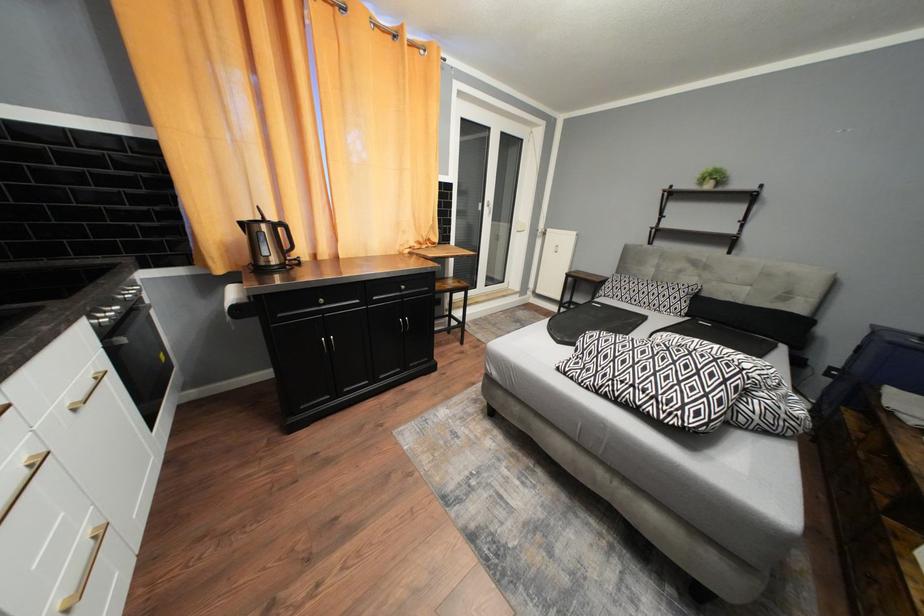
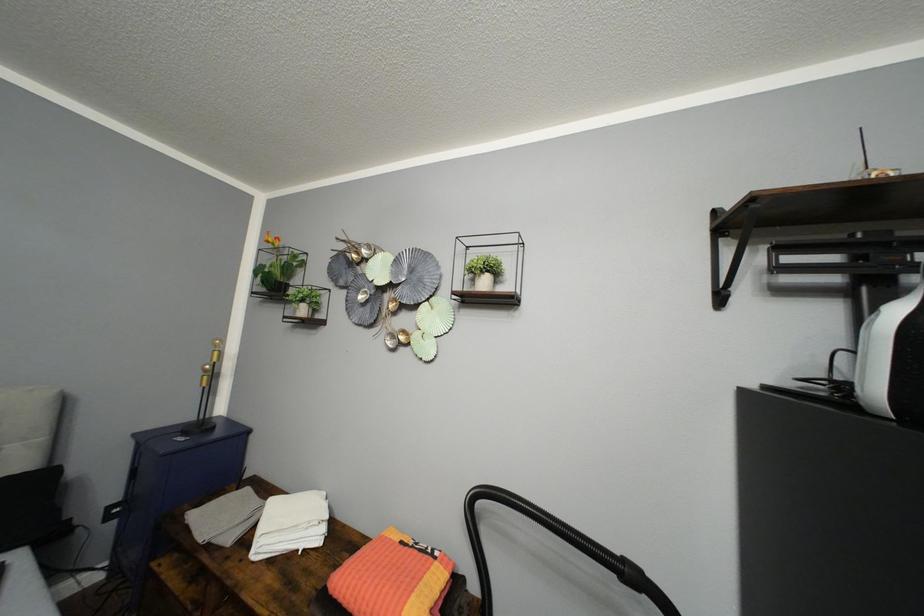
Question: The images are taken continuously from a first-person perspective. In which direction is your viewpoint rotating?

Choices:
 (A) Left
 (B) Right
 (C) Up
 (D) Down

Answer: (B)